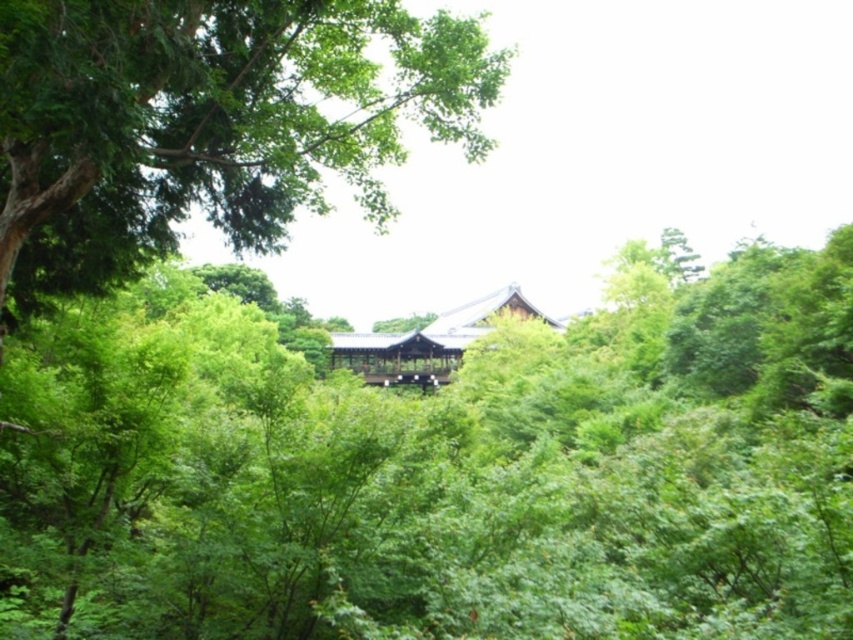
You are a GUI agent. You are given a task and a screenshot of the screen. Output one action in this format:
    pyautogui.click(x=<x>, y=<y>)
    Task: Click on the green leafy forest at center
    The width and height of the screenshot is (853, 640).
    Given the screenshot: What is the action you would take?
    pyautogui.click(x=442, y=470)

Which is below, green leafy forest at center or shiny dark brown wooden hut at center?

green leafy forest at center

Who is more distant from viewer, (x=97, y=328) or (x=428, y=387)?

Point (x=428, y=387)

Locate an element on the screen. green leafy forest at center is located at coordinates (442, 470).